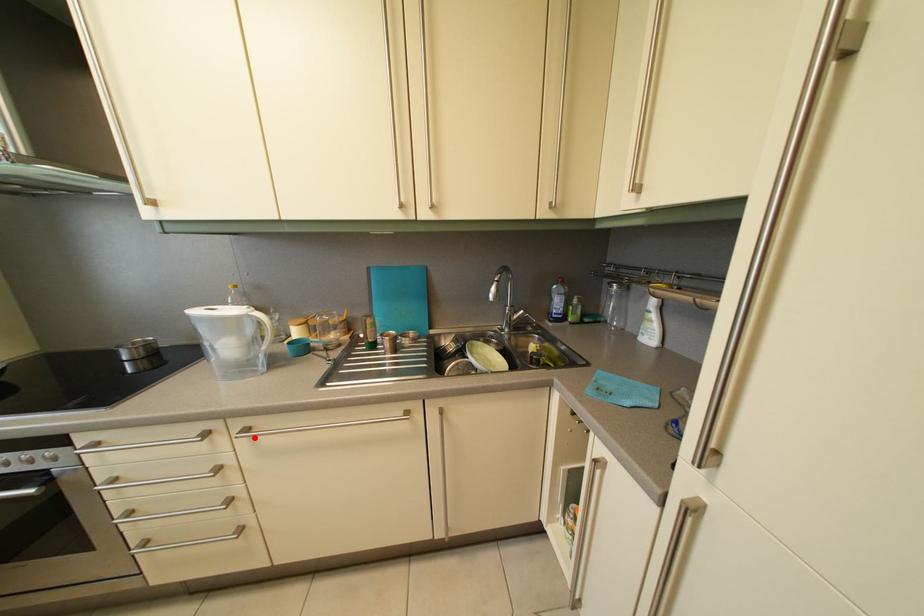
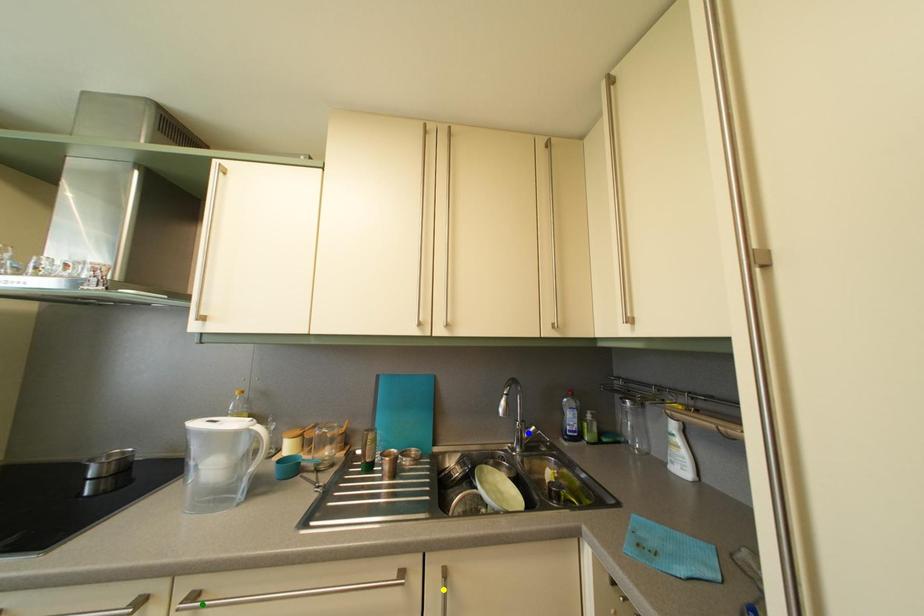
Question: I am providing you with two images of the same scene from different viewpoints. A red point is marked on the first image. You are given multiple points on the second image. In image 2, which mark is for the same physical point as the one in image 1?

Choices:
 (A) green point
 (B) yellow point
 (C) blue point

Answer: (A)